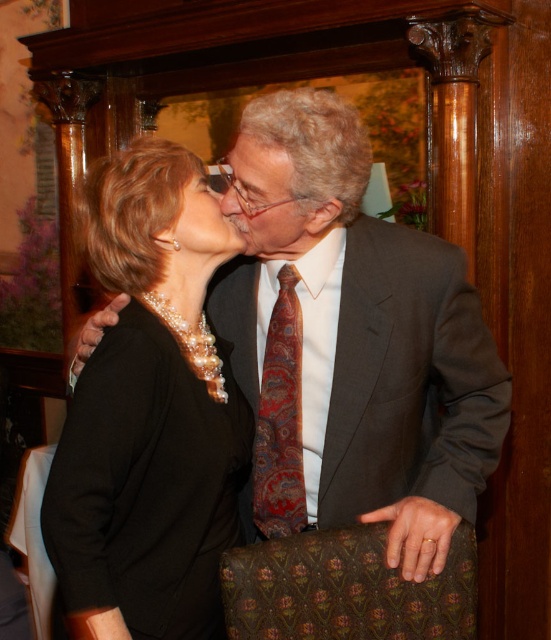
Question: Does matte black suit at center have a lesser width compared to paisley-patterned silk tie at center?

Choices:
 (A) no
 (B) yes

Answer: (A)

Question: Can you confirm if dark gray wool suit at center is positioned to the right of paisley-patterned silk tie at center?

Choices:
 (A) no
 (B) yes

Answer: (B)

Question: Among these points, which one is farthest from the camera?

Choices:
 (A) (291, 483)
 (B) (77, 388)
 (C) (202, 241)
 (D) (364, 451)

Answer: (A)

Question: Which object is positioned closest to the dark gray wool suit at center?

Choices:
 (A) paisley silk tie at center
 (B) matte black suit at center
 (C) paisley-patterned silk tie at center
 (D) black satin dress at center

Answer: (B)

Question: Which point is closer to the camera?

Choices:
 (A) matte black suit at center
 (B) paisley silk tie at center
 (C) paisley-patterned silk tie at center

Answer: (A)

Question: Is black satin dress at center to the right of paisley silk tie at center from the viewer's perspective?

Choices:
 (A) no
 (B) yes

Answer: (A)